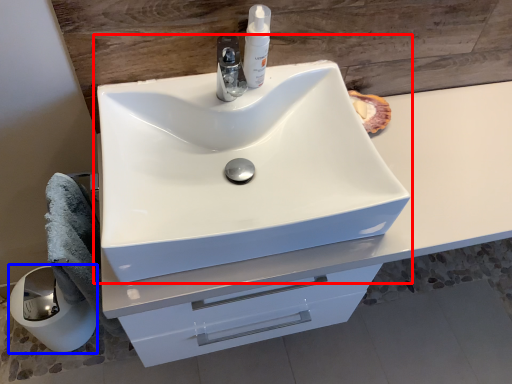
Question: Which of the following is the closest to the observer, sink (highlighted by a red box) or paper towel (highlighted by a blue box)?

Choices:
 (A) sink
 (B) paper towel

Answer: (A)